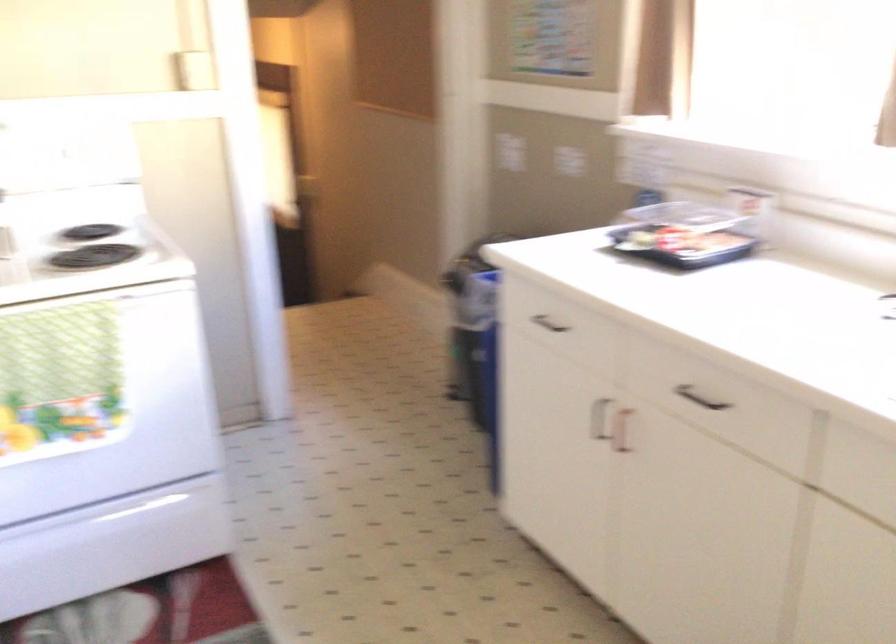
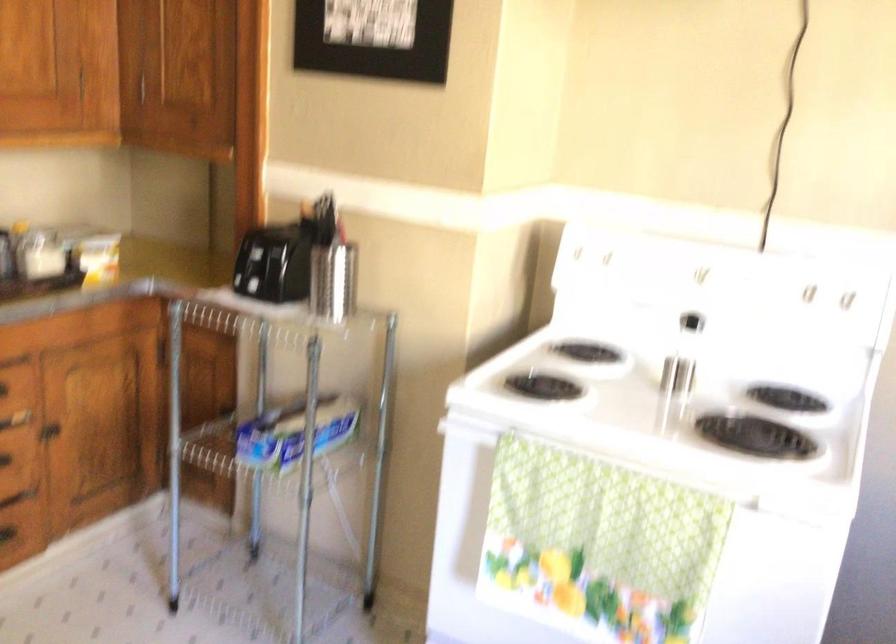
The point at (97, 151) is marked in the first image. Where is the corresponding point in the second image?

(805, 292)